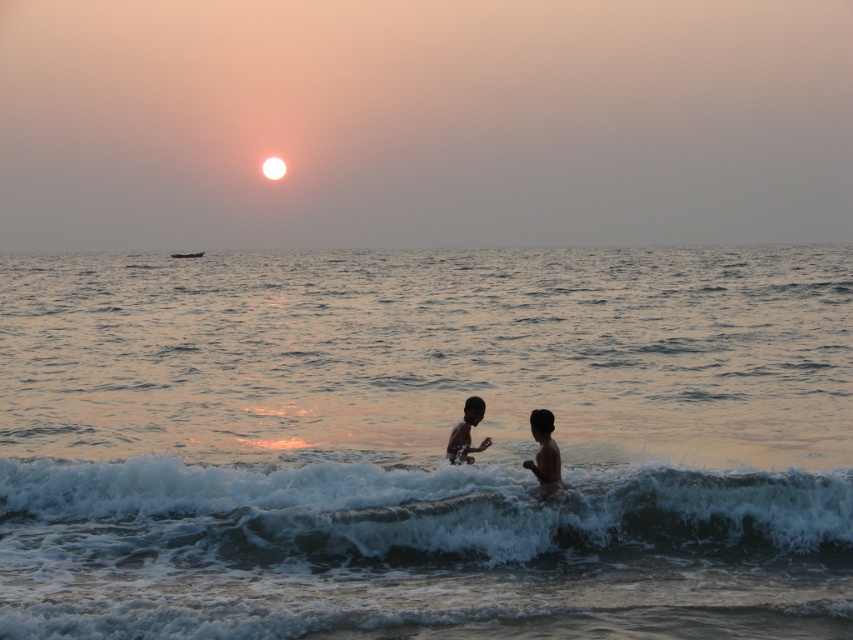
Is translucent water at wave center to the right of dark skin child at center from the viewer's perspective?

Correct, you'll find translucent water at wave center to the right of dark skin child at center.

Who is positioned more to the right, translucent water at wave center or dark skin child at center?

translucent water at wave center

Where is `translucent water at wave center`? Image resolution: width=853 pixels, height=640 pixels. translucent water at wave center is located at coordinates (426, 444).

Does smooth skin child at center have a lesser height compared to white foam surf at upper center?

Correct, smooth skin child at center is not as tall as white foam surf at upper center.

Measure the distance from smooth skin child at center to white foam surf at upper center.

smooth skin child at center and white foam surf at upper center are 105.27 meters apart.

Looking at this image, measure the distance between smooth skin child at center and camera.

smooth skin child at center is 11.57 meters away from camera.

Identify the location of smooth skin child at center. The height and width of the screenshot is (640, 853). click(544, 452).

Consider the image. Does white foamy wave at lower center come in front of smooth skin child at center?

Yes.

Is white foamy wave at lower center shorter than smooth skin child at center?

Indeed, white foamy wave at lower center has a lesser height compared to smooth skin child at center.

What do you see at coordinates (410, 516) in the screenshot? I see `white foamy wave at lower center` at bounding box center [410, 516].

Locate an element on the screen. white foamy wave at lower center is located at coordinates (410, 516).